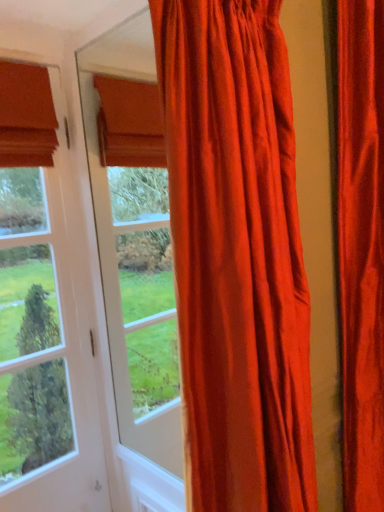
Question: Is satin red curtain at right, the first curtain when ordered from right to left, completely or partially outside of clear glass door at left?

Choices:
 (A) no
 (B) yes

Answer: (B)

Question: Considering the relative sizes of satin red curtain at right, which is the second curtain in left-to-right order, and clear glass door at left in the image provided, is satin red curtain at right, which is the second curtain in left-to-right order, bigger than clear glass door at left?

Choices:
 (A) yes
 (B) no

Answer: (A)

Question: Is satin red curtain at right, the first curtain when ordered from right to left, at the left side of clear glass door at left?

Choices:
 (A) yes
 (B) no

Answer: (B)

Question: Does satin red curtain at right, which is the second curtain in left-to-right order, have a greater height compared to clear glass door at left?

Choices:
 (A) yes
 (B) no

Answer: (A)

Question: From a real-world perspective, is satin red curtain at right, the first curtain when ordered from right to left, positioned under clear glass door at left based on gravity?

Choices:
 (A) yes
 (B) no

Answer: (B)

Question: Considering the relative sizes of satin red curtain at right, the first curtain when ordered from right to left, and clear glass door at left in the image provided, is satin red curtain at right, the first curtain when ordered from right to left, wider than clear glass door at left?

Choices:
 (A) no
 (B) yes

Answer: (B)

Question: Is satin orange curtain at center, which is counted as the second curtain, starting from the right, closer to the viewer compared to satin red curtain at right, which is the second curtain in left-to-right order?

Choices:
 (A) yes
 (B) no

Answer: (A)

Question: Is satin orange curtain at center, which is the 1th curtain in left-to-right order, located outside satin red curtain at right, which is the second curtain in left-to-right order?

Choices:
 (A) no
 (B) yes

Answer: (B)

Question: Does satin orange curtain at center, which is the 1th curtain in left-to-right order, touch satin red curtain at right, which is the second curtain in left-to-right order?

Choices:
 (A) yes
 (B) no

Answer: (B)

Question: Is satin red curtain at right, the first curtain when ordered from right to left, located within satin orange curtain at center, which is the 1th curtain in left-to-right order?

Choices:
 (A) yes
 (B) no

Answer: (B)

Question: Can you confirm if satin orange curtain at center, which is the 1th curtain in left-to-right order, is wider than satin red curtain at right, the first curtain when ordered from right to left?

Choices:
 (A) yes
 (B) no

Answer: (B)

Question: Is the position of satin orange curtain at center, which is counted as the second curtain, starting from the right, more distant than that of satin red curtain at right, which is the second curtain in left-to-right order?

Choices:
 (A) no
 (B) yes

Answer: (A)

Question: Can you confirm if clear glass door at left is taller than satin red curtain at right, which is the second curtain in left-to-right order?

Choices:
 (A) yes
 (B) no

Answer: (B)